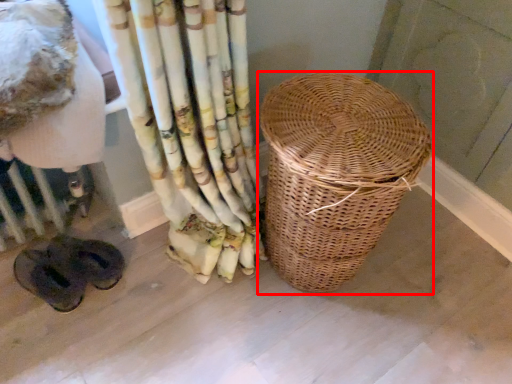
Question: From the image's perspective, considering the relative positions of picnic basket (annotated by the red box) and radiator in the image provided, where is picnic basket (annotated by the red box) located with respect to the staircase?

Choices:
 (A) above
 (B) below

Answer: (A)